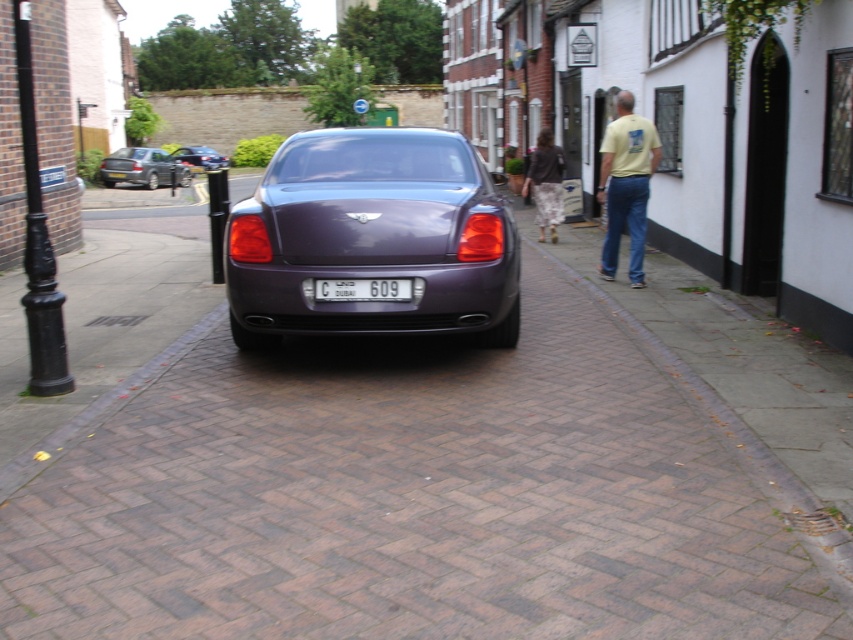
Between camouflage pants at center and white plastic license plate at center, which one has more height?

Standing taller between the two is camouflage pants at center.

Between camouflage pants at center and white plastic license plate at center, which one appears on the right side from the viewer's perspective?

From the viewer's perspective, camouflage pants at center appears more on the right side.

This screenshot has width=853, height=640. In order to click on camouflage pants at center in this screenshot , I will do `click(544, 182)`.

This screenshot has height=640, width=853. In order to click on camouflage pants at center in this screenshot , I will do `click(544, 182)`.

Which is in front, point (25, 484) or point (142, 154)?

Positioned in front is point (25, 484).

Which is above, brick pavement at center or metallic silver sedan at upper left?

metallic silver sedan at upper left

Does point (440, 541) come farther from viewer compared to point (155, 164)?

No, it is not.

At what (x,y) coordinates should I click in order to perform the action: click on brick pavement at center. Please return your answer as a coordinate pair (x, y). This screenshot has width=853, height=640. Looking at the image, I should click on (421, 465).

Which is behind, point (558, 316) or point (538, 200)?

Positioned behind is point (538, 200).

Does point (466, 598) come in front of point (554, 186)?

Yes, point (466, 598) is in front of point (554, 186).

In order to click on brick pavement at center in this screenshot , I will do `click(421, 465)`.